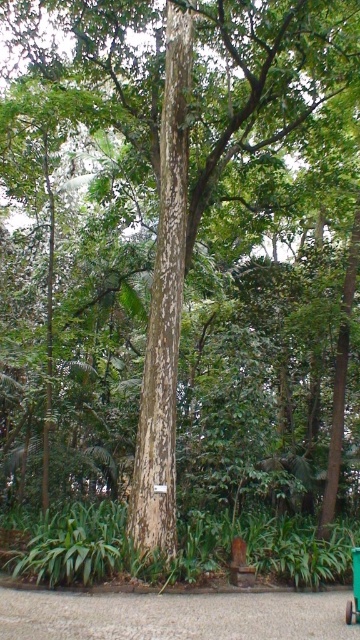
You are standing in a tropical garden and want to take a photo of the speckled bark tree trunk at center. If your camera has a maximum focus range of 8 meters, will it be able to capture the tree trunk clearly?

The speckled bark tree trunk at center and camera are 8.83 meters apart. Since the distance exceeds the camera maximum focus range of 8 meters, the camera cannot capture the tree trunk clearly.

You are a gardener who needs to move a green plastic cart at center to the side of the speckled bark tree trunk at center. Considering their widths, will the cart fit next to the tree without overlapping?

The speckled bark tree trunk at center is wider than the green plastic cart at center. Since the tree trunk is wider, there should be enough space for the cart to fit next to it without overlapping.

You are a gardener who needs to move the green plastic cart at center to a new location. However, you want to ensure that the cart doesn not block the view of the speckled bark tree trunk at center. Based on their positions, can you move the cart to a spot where it won t be in front of the tree trunk?

The speckled bark tree trunk at center is located above the green plastic cart at center, so if you move the cart to a position where it is no longer directly below or in front of the tree trunk, it won t block the view. For example, moving it to the side or further away from the base of the tree would keep the tree trunk visible.